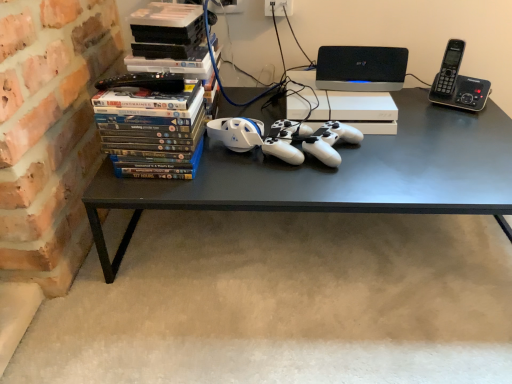
Describe the element at coordinates (458, 82) in the screenshot. I see `black plastic phone at upper right` at that location.

Measure the distance between point (351, 82) and camera.

They are 1.16 meters apart.

Measure the distance between matte plastic dvds at left and camera.

A distance of 82.35 centimeters exists between matte plastic dvds at left and camera.

What is the approximate width of matte plastic dvds at left?

It is 4.79 inches.

Identify the location of black plastic phone at upper right. (458, 82).

Which of these two, black plastic phone at upper right or black matte desk at center, is bigger?

black matte desk at center is bigger.

Which of these two, black plastic phone at upper right or black matte desk at center, is thinner?

With smaller width is black plastic phone at upper right.

Does black plastic phone at upper right lie behind black matte desk at center?

That is True.

Is black matte desk at center completely or partially inside black plastic phone at upper right?

No, black plastic phone at upper right does not contain black matte desk at center.

Considering the positions of objects black matte desk at center and black plastic phone at upper right in the image provided, who is in front, black matte desk at center or black plastic phone at upper right?

black matte desk at center is closer to the camera.

Considering the relative sizes of black matte desk at center and black plastic phone at upper right in the image provided, is black matte desk at center wider than black plastic phone at upper right?

Correct, the width of black matte desk at center exceeds that of black plastic phone at upper right.

Is black matte desk at center oriented away from black plastic phone at upper right?

black matte desk at center is not turned away from black plastic phone at upper right.

From a real-world perspective, which is physically above, black matte desk at center or black plastic phone at upper right?

In real-world perspective, black plastic phone at upper right is above.

Is black plastic speaker at upper center at the back of matte plastic dvds at left?

That's not correct — matte plastic dvds at left is not looking away from black plastic speaker at upper center.

From a real-world perspective, which is physically above, matte plastic dvds at left or black plastic speaker at upper center?

In real-world perspective, black plastic speaker at upper center is above.

Is matte plastic dvds at left situated inside black plastic speaker at upper center or outside?

matte plastic dvds at left is spatially situated outside black plastic speaker at upper center.

Does black matte desk at center come in front of black plastic speaker at upper center?

Yes, black matte desk at center is in front of black plastic speaker at upper center.

Which object is thinner, black matte desk at center or black plastic speaker at upper center?

With smaller width is black plastic speaker at upper center.

Considering the sizes of objects black matte desk at center and black plastic speaker at upper center in the image provided, who is taller, black matte desk at center or black plastic speaker at upper center?

With more height is black matte desk at center.

Consider the image. From the image's perspective, is black matte desk at center above or below black plastic speaker at upper center?

black matte desk at center is below black plastic speaker at upper center.

Considering the sizes of objects matte plastic dvds at left and black matte desk at center in the image provided, who is wider, matte plastic dvds at left or black matte desk at center?

Wider between the two is black matte desk at center.

In terms of height, does matte plastic dvds at left look taller or shorter compared to black matte desk at center?

In the image, matte plastic dvds at left appears to be shorter than black matte desk at center.

Who is smaller, matte plastic dvds at left or black matte desk at center?

Smaller between the two is matte plastic dvds at left.

Considering the points (453, 102) and (359, 59), which point is behind, point (453, 102) or point (359, 59)?

The point (453, 102) is farther from the camera.

Is black plastic phone at upper right further to the viewer compared to black plastic speaker at upper center?

That is False.

Can you confirm if black plastic phone at upper right is positioned to the left of black plastic speaker at upper center?

In fact, black plastic phone at upper right is to the right of black plastic speaker at upper center.

Can you confirm if black plastic phone at upper right is bigger than black plastic speaker at upper center?

Correct, black plastic phone at upper right is larger in size than black plastic speaker at upper center.

Can matte plastic dvds at left be found inside black plastic phone at upper right?

No, matte plastic dvds at left is located outside of black plastic phone at upper right.

Can you confirm if black plastic phone at upper right is taller than matte plastic dvds at left?

No, black plastic phone at upper right is not taller than matte plastic dvds at left.

Looking at this image, from a real-world perspective, is black plastic phone at upper right physically above matte plastic dvds at left?

Yes.

Considering the positions of objects black plastic phone at upper right and matte plastic dvds at left in the image provided, who is more to the right, black plastic phone at upper right or matte plastic dvds at left?

black plastic phone at upper right.

Identify the location of desk on the left of black plastic phone at upper right. (339, 175).

The width and height of the screenshot is (512, 384). Find the location of `desk below the black plastic phone at upper right (from a real-world perspective)`. desk below the black plastic phone at upper right (from a real-world perspective) is located at coordinates (339, 175).

Looking at this image, when comparing their distances from matte plastic dvds at left, does black plastic speaker at upper center or black matte desk at center seem further?

black plastic speaker at upper center is further to matte plastic dvds at left.

When comparing their distances from black plastic phone at upper right, does black plastic speaker at upper center or matte plastic dvds at left seem further?

matte plastic dvds at left.

From the image, which object appears to be farther from black matte desk at center, matte plastic dvds at left or black plastic phone at upper right?

Among the two, black plastic phone at upper right is located further to black matte desk at center.

Based on their spatial positions, is matte plastic dvds at left or black plastic speaker at upper center closer to black plastic phone at upper right?

black plastic speaker at upper center lies closer to black plastic phone at upper right than the other object.

Based on the photo, estimate the real-world distances between objects in this image. Which object is closer to matte plastic dvds at left, black matte desk at center or black plastic phone at upper right?

black matte desk at center is closer to matte plastic dvds at left.

From the image, which object appears to be nearer to black matte desk at center, black plastic speaker at upper center or black plastic phone at upper right?

black plastic speaker at upper center lies closer to black matte desk at center than the other object.

Estimate the real-world distances between objects in this image. Which object is further from black plastic speaker at upper center, black plastic phone at upper right or matte plastic dvds at left?

matte plastic dvds at left lies further to black plastic speaker at upper center than the other object.

When comparing their distances from black plastic phone at upper right, does black matte desk at center or matte plastic dvds at left seem closer?

black matte desk at center.

Where is `computer between matte plastic dvds at left and black plastic phone at upper right`? This screenshot has width=512, height=384. computer between matte plastic dvds at left and black plastic phone at upper right is located at coordinates (361, 68).

Identify the location of computer between black matte desk at center and black plastic phone at upper right from left to right. (361, 68).

At what (x,y) coordinates should I click in order to perform the action: click on desk located between matte plastic dvds at left and black plastic speaker at upper center in the left-right direction. Please return your answer as a coordinate pair (x, y). Looking at the image, I should click on (339, 175).

This screenshot has height=384, width=512. I want to click on desk between matte plastic dvds at left and black plastic phone at upper right, so click(x=339, y=175).